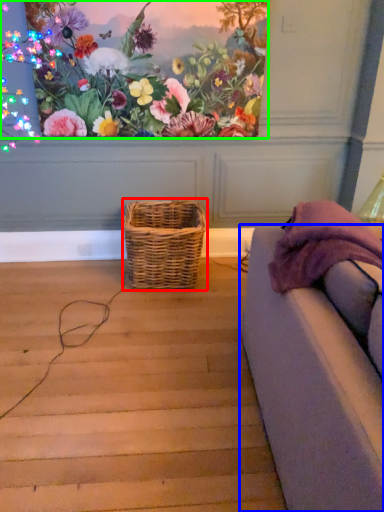
Question: Based on their relative distances, which object is farther from picnic basket (highlighted by a red box)? Choose from studio couch (highlighted by a blue box) and flower (highlighted by a green box).

Choices:
 (A) studio couch
 (B) flower

Answer: (A)